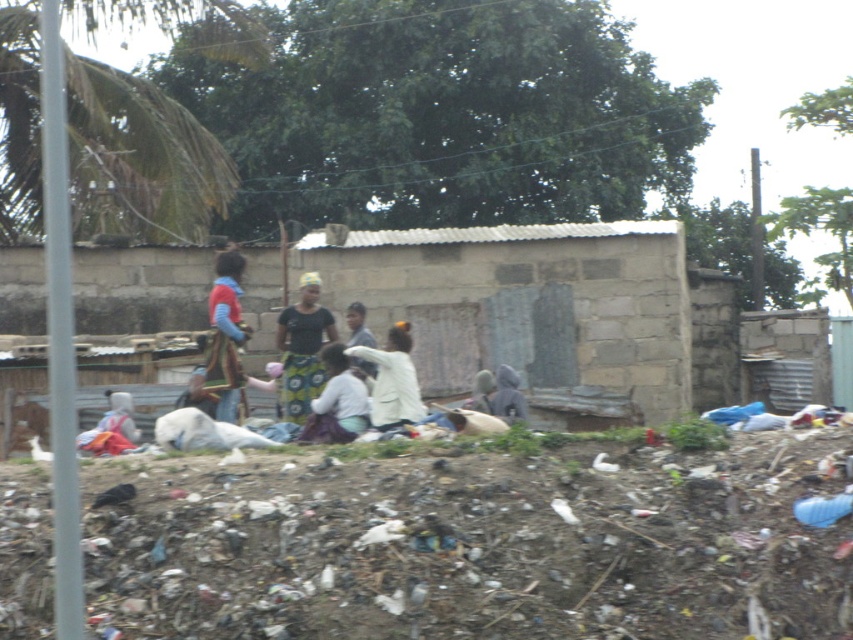
In the scene shown: You are a fashion designer observing the scene. You notice the black printed dress at center and the white matte jacket at center. Which clothing item is bigger in size?

The black printed dress at center has a larger size compared to the white matte jacket at center.

You are a photographer standing at the edge of the debris pile. You want to take a photo that includes both the multicolored fabric at center and the gray matte jacket at center. Which object should you position to the left side of your frame to include both?

To include both the multicolored fabric at center and the gray matte jacket at center in your photo, position the multicolored fabric at center on the left side of your frame since it is already to the left of the gray matte jacket at center.